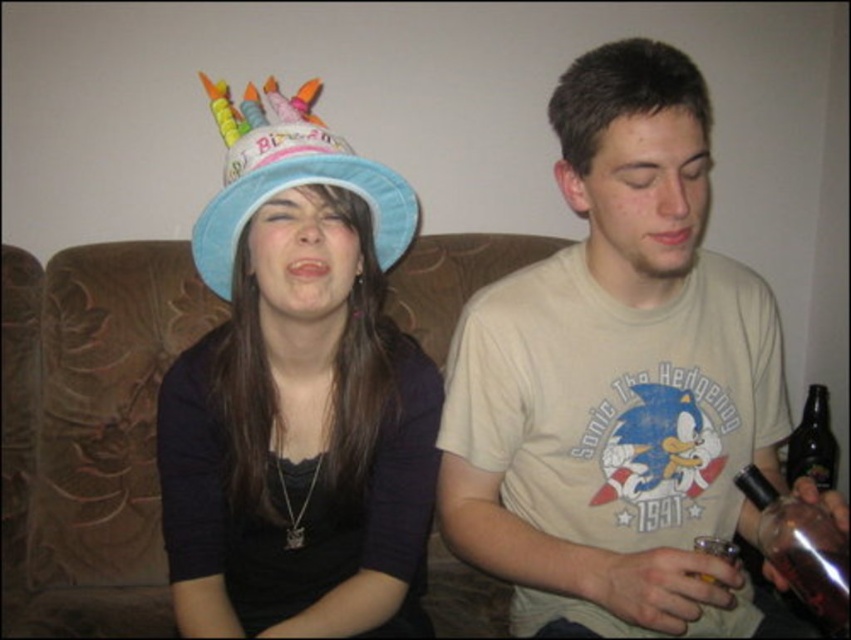
Question: Which object appears closest to the camera in this image?

Choices:
 (A) blue paper hat at upper left
 (B) matte blue hat at center

Answer: (A)

Question: Which point is farther to the camera?

Choices:
 (A) brown fabric couch at center
 (B) dark brown glass bottle at lower right
 (C) matte blue hat at center

Answer: (B)

Question: Can you confirm if matte blue hat at center is positioned to the left of brown fabric couch at center?

Choices:
 (A) no
 (B) yes

Answer: (A)

Question: Which point is farther from the camera taking this photo?

Choices:
 (A) (333, 484)
 (B) (824, 483)
 (C) (130, 576)

Answer: (B)

Question: In this image, where is matte blue hat at center located relative to translucent glass bottle at lower right?

Choices:
 (A) right
 (B) left

Answer: (B)

Question: Considering the relative positions of translucent glass bottle at lower right and dark brown glass bottle at lower right in the image provided, where is translucent glass bottle at lower right located with respect to dark brown glass bottle at lower right?

Choices:
 (A) right
 (B) left

Answer: (B)